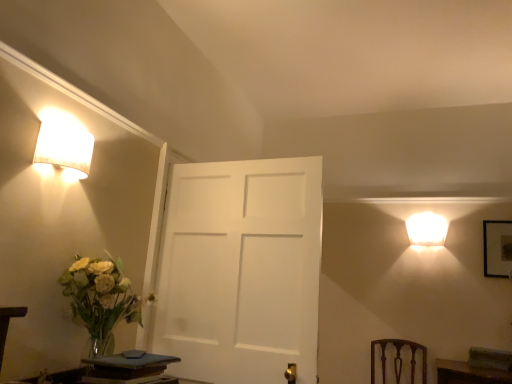
Locate an element on the screen. This screenshot has height=384, width=512. brown wood chair at lower right is located at coordinates (398, 357).

What do you see at coordinates (8, 324) in the screenshot?
I see `wooden table at lower left, positioned as the first table in left-to-right order` at bounding box center [8, 324].

The height and width of the screenshot is (384, 512). Describe the element at coordinates (64, 144) in the screenshot. I see `matte white lampshade at upper left, the 2th lamp viewed from the right` at that location.

Locate an element on the screen. This screenshot has width=512, height=384. matte white lampshade at upper left, which appears as the second lamp when viewed from the back is located at coordinates (64, 144).

The height and width of the screenshot is (384, 512). In order to click on brown wood chair at lower right in this screenshot , I will do `click(398, 357)`.

Considering the relative positions of smooth dark wood table at lower left, the 2th table viewed from the front, and wooden table at lower left, which is the first table in front-to-back order, in the image provided, is smooth dark wood table at lower left, the 2th table viewed from the front, to the left or to the right of wooden table at lower left, which is the first table in front-to-back order,?

smooth dark wood table at lower left, the 2th table viewed from the front, is positioned on wooden table at lower left, which is the first table in front-to-back order,'s right side.

Is point (100, 358) closer or farther from the camera than point (23, 313)?

Point (100, 358).

Is smooth dark wood table at lower left, the first table viewed from the right, positioned beyond the bounds of wooden table at lower left, the 2th table positioned from the right?

Indeed, smooth dark wood table at lower left, the first table viewed from the right, is completely outside wooden table at lower left, the 2th table positioned from the right.

Are wooden table at lower left, marked as the 2th table in a back-to-front arrangement, and matte white lampshade at upper left, which appears as the second lamp when viewed from the back, located far from each other?

That's not correct — wooden table at lower left, marked as the 2th table in a back-to-front arrangement, is a little close to matte white lampshade at upper left, which appears as the second lamp when viewed from the back.

Is wooden table at lower left, positioned as the first table in left-to-right order, in front of matte white lampshade at upper left, the 2th lamp viewed from the right?

Yes, the depth of wooden table at lower left, positioned as the first table in left-to-right order, is less than that of matte white lampshade at upper left, the 2th lamp viewed from the right.

Consider the image. Can you tell me how much wooden table at lower left, the 2th table positioned from the right, and matte white lampshade at upper left, the 2th lamp viewed from the right, differ in facing direction?

wooden table at lower left, the 2th table positioned from the right, and matte white lampshade at upper left, the 2th lamp viewed from the right, are facing 0.00354 degrees away from each other.

Is point (0, 326) behind point (69, 141)?

No, (0, 326) is closer to viewer.

From a real-world perspective, is smooth dark wood table at lower left, the first table viewed from the right, on white matte lampshade at upper right, placed as the 2th lamp when sorted from left to right?

Actually, smooth dark wood table at lower left, the first table viewed from the right, is physically below white matte lampshade at upper right, placed as the 2th lamp when sorted from left to right, in the real world.

From their relative heights in the image, would you say smooth dark wood table at lower left, which is the second table in left-to-right order, is taller or shorter than white matte lampshade at upper right, placed as the 2th lamp when sorted from left to right?

smooth dark wood table at lower left, which is the second table in left-to-right order, is shorter than white matte lampshade at upper right, placed as the 2th lamp when sorted from left to right.

Considering the relative sizes of smooth dark wood table at lower left, the 2th table viewed from the front, and white matte lampshade at upper right, which ranks as the first lamp in back-to-front order, in the image provided, is smooth dark wood table at lower left, the 2th table viewed from the front, smaller than white matte lampshade at upper right, which ranks as the first lamp in back-to-front order,?

No, smooth dark wood table at lower left, the 2th table viewed from the front, is not smaller than white matte lampshade at upper right, which ranks as the first lamp in back-to-front order.

Is point (115, 320) closer or farther from the camera than point (420, 214)?

Point (115, 320).

What's the angular difference between translucent glass vase at left and white matte lampshade at upper right, which appears as the 1th lamp when ordered from the bottom,'s facing directions?

The angle between the facing direction of translucent glass vase at left and the facing direction of white matte lampshade at upper right, which appears as the 1th lamp when ordered from the bottom, is 92.5 degrees.

Locate an element on the screen. The image size is (512, 384). the 1st lamp directly above the translucent glass vase at left (from a real-world perspective) is located at coordinates pos(426,229).

Is brown wood chair at lower right in front of or behind smooth dark wood table at lower left, the 1th table positioned from the back, in the image?

Visually, brown wood chair at lower right is located behind smooth dark wood table at lower left, the 1th table positioned from the back.

Which is correct: brown wood chair at lower right is inside smooth dark wood table at lower left, the 1th table positioned from the back, or outside of it?

brown wood chair at lower right is spatially situated outside smooth dark wood table at lower left, the 1th table positioned from the back.

Consider the image. Is brown wood chair at lower right touching smooth dark wood table at lower left, the 1th table positioned from the back?

brown wood chair at lower right and smooth dark wood table at lower left, the 1th table positioned from the back, are clearly separated.

From the image's perspective, which one is positioned higher, brown wood chair at lower right or smooth dark wood table at lower left, which is the second table in left-to-right order?

smooth dark wood table at lower left, which is the second table in left-to-right order, appears higher in the image.

Consider the image. From the image's perspective, is translucent glass vase at left located beneath brown wood chair at lower right?

Actually, translucent glass vase at left appears above brown wood chair at lower right in the image.

Measure the distance between translucent glass vase at left and brown wood chair at lower right.

translucent glass vase at left is 7.69 feet away from brown wood chair at lower right.

Who is bigger, translucent glass vase at left or brown wood chair at lower right?

Bigger between the two is brown wood chair at lower right.

Does matte white lampshade at upper left, which appears as the second lamp when viewed from the back, have a larger size compared to white matte lampshade at upper right, which ranks as the first lamp in back-to-front order?

No, matte white lampshade at upper left, which appears as the second lamp when viewed from the back, is not bigger than white matte lampshade at upper right, which ranks as the first lamp in back-to-front order.

Considering the sizes of objects matte white lampshade at upper left, which appears as the second lamp when viewed from the back, and white matte lampshade at upper right, which appears as the 1th lamp when ordered from the bottom, in the image provided, who is thinner, matte white lampshade at upper left, which appears as the second lamp when viewed from the back, or white matte lampshade at upper right, which appears as the 1th lamp when ordered from the bottom,?

matte white lampshade at upper left, which appears as the second lamp when viewed from the back.

How far apart are matte white lampshade at upper left, positioned as the 1th lamp in front-to-back order, and white matte lampshade at upper right, which appears as the 1th lamp when ordered from the bottom?

matte white lampshade at upper left, positioned as the 1th lamp in front-to-back order, and white matte lampshade at upper right, which appears as the 1th lamp when ordered from the bottom, are 8.99 feet apart.

Is white matte lampshade at upper right, which ranks as the second lamp in top-to-bottom order, a part of matte white lampshade at upper left, which ranks as the 2th lamp in bottom-to-top order?

No, white matte lampshade at upper right, which ranks as the second lamp in top-to-bottom order, is not a part of matte white lampshade at upper left, which ranks as the 2th lamp in bottom-to-top order.

The width and height of the screenshot is (512, 384). What are the coordinates of `table above the smooth dark wood table at lower left, the 2th table viewed from the front (from the image's perspective)` in the screenshot? It's located at (8, 324).

At what (x,y) coordinates should I click in order to perform the action: click on the 2nd table in front of the matte white lampshade at upper left, positioned as the first lamp in left-to-right order. Please return your answer as a coordinate pair (x, y). Image resolution: width=512 pixels, height=384 pixels. Looking at the image, I should click on (8, 324).

From the image, which object appears to be nearer to brown wood chair at lower right, smooth dark wood table at lower left, the 2th table viewed from the front, or matte white lampshade at upper left, the 2th lamp viewed from the right?

Among the two, smooth dark wood table at lower left, the 2th table viewed from the front, is located nearer to brown wood chair at lower right.

Consider the image. From the image, which object appears to be farther from smooth dark wood table at lower left, the 2th table viewed from the front, brown wood chair at lower right or wooden table at lower left, marked as the 2th table in a back-to-front arrangement?

brown wood chair at lower right is positioned further to the anchor smooth dark wood table at lower left, the 2th table viewed from the front.

Considering their positions, is smooth dark wood table at lower left, the 2th table viewed from the front, positioned closer to matte white lampshade at upper left, the 2th lamp viewed from the right, than translucent glass vase at left?

translucent glass vase at left is closer to matte white lampshade at upper left, the 2th lamp viewed from the right.

Considering their positions, is smooth dark wood table at lower left, the first table viewed from the right, positioned closer to wooden table at lower left, marked as the 2th table in a back-to-front arrangement, than white matte lampshade at upper right, which ranks as the second lamp in top-to-bottom order?

Based on the image, smooth dark wood table at lower left, the first table viewed from the right, appears to be nearer to wooden table at lower left, marked as the 2th table in a back-to-front arrangement.

From the picture: Looking at the image, which one is located closer to matte white lampshade at upper left, the 2th lamp viewed from the right, translucent glass vase at left or brown wood chair at lower right?

translucent glass vase at left is closer to matte white lampshade at upper left, the 2th lamp viewed from the right.

Which object lies further to the anchor point brown wood chair at lower right, matte white lampshade at upper left, the 2th lamp viewed from the right, or white matte lampshade at upper right, which ranks as the first lamp in back-to-front order?

Based on the image, matte white lampshade at upper left, the 2th lamp viewed from the right, appears to be further to brown wood chair at lower right.

Looking at the image, which one is located further to white matte lampshade at upper right, the second lamp in the front-to-back sequence, brown wood chair at lower right or smooth dark wood table at lower left, which is the second table in left-to-right order?

Based on the image, smooth dark wood table at lower left, which is the second table in left-to-right order, appears to be further to white matte lampshade at upper right, the second lamp in the front-to-back sequence.

From the image, which object appears to be nearer to white matte lampshade at upper right, which ranks as the second lamp in top-to-bottom order, matte white lampshade at upper left, positioned as the first lamp in left-to-right order, or brown wood chair at lower right?

brown wood chair at lower right.

The height and width of the screenshot is (384, 512). Identify the location of floral arrangement between matte white lampshade at upper left, positioned as the 1th lamp in front-to-back order, and wooden table at lower left, positioned as the first table in left-to-right order, from top to bottom. (100, 299).

Image resolution: width=512 pixels, height=384 pixels. I want to click on table located between matte white lampshade at upper left, which appears as the 1th lamp when viewed from the top, and brown wood chair at lower right in the left-right direction, so click(x=126, y=367).

I want to click on furniture between wooden table at lower left, which is the first table in front-to-back order, and white matte lampshade at upper right, placed as the 2th lamp when sorted from left to right, in the horizontal direction, so click(x=398, y=357).

Where is `floral arrangement between wooden table at lower left, marked as the 2th table in a back-to-front arrangement, and white matte lampshade at upper right, the second lamp in the front-to-back sequence`? Image resolution: width=512 pixels, height=384 pixels. floral arrangement between wooden table at lower left, marked as the 2th table in a back-to-front arrangement, and white matte lampshade at upper right, the second lamp in the front-to-back sequence is located at coordinates (100, 299).